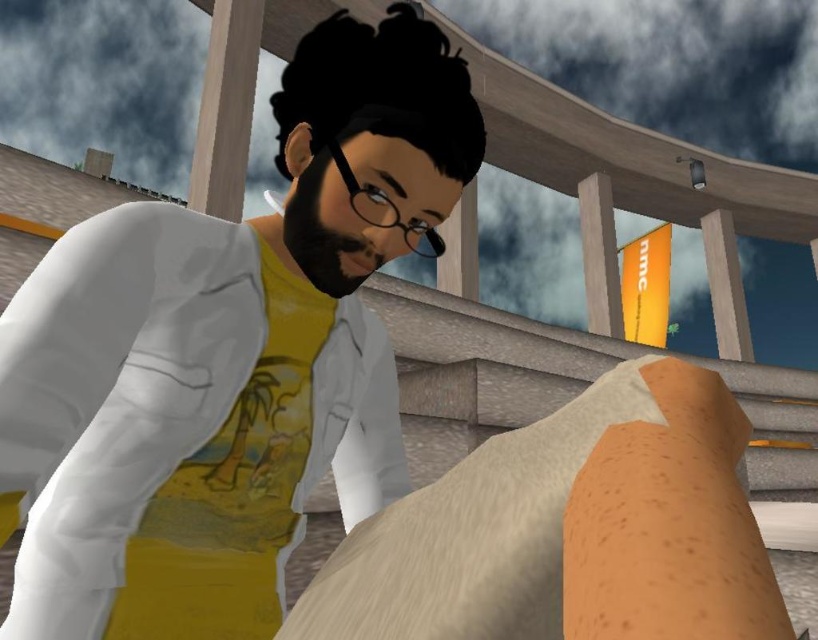
Based on the photo, does wooden post at upper center have a greater width compared to wooden at upper center?

Yes.

Is wooden post at upper center behind wooden at upper center?

No.

Is point (201, 134) positioned behind point (587, 328)?

No, (201, 134) is closer to viewer.

I want to click on wooden post at upper center, so click(225, 108).

Is wooden post at upper center wider than smooth gray pillar at upper right?

In fact, wooden post at upper center might be narrower than smooth gray pillar at upper right.

Can you confirm if wooden post at upper center is shorter than smooth gray pillar at upper right?

Incorrect, wooden post at upper center's height does not fall short of smooth gray pillar at upper right's.

Who is more distant from viewer, (255, 65) or (727, 323)?

Point (727, 323)

Locate an element on the screen. wooden post at upper center is located at coordinates (225, 108).

Between white matte lab coat at center and wooden at upper center, which one has less height?

white matte lab coat at center

Which is behind, point (97, 486) or point (603, 189)?

The point (603, 189) is more distant.

Locate an element on the screen. The height and width of the screenshot is (640, 818). white matte lab coat at center is located at coordinates (178, 426).